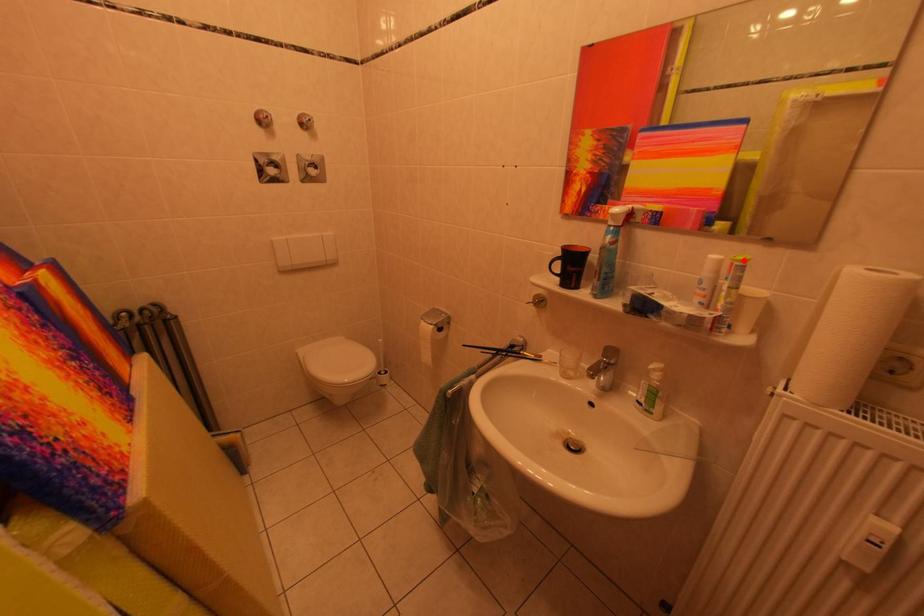
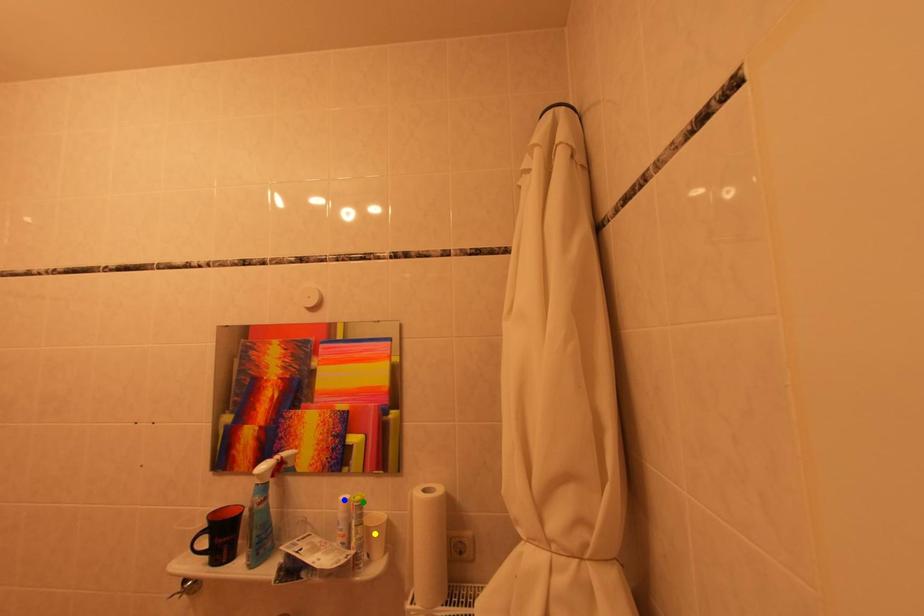
Question: I am providing you with two images of the same scene from different viewpoints. A red point is marked on the first image. You are given multiple points on the second image. In image 2, which mark is for the same physical point as the one in image 1?

Choices:
 (A) blue point
 (B) yellow point
 (C) green point

Answer: (C)